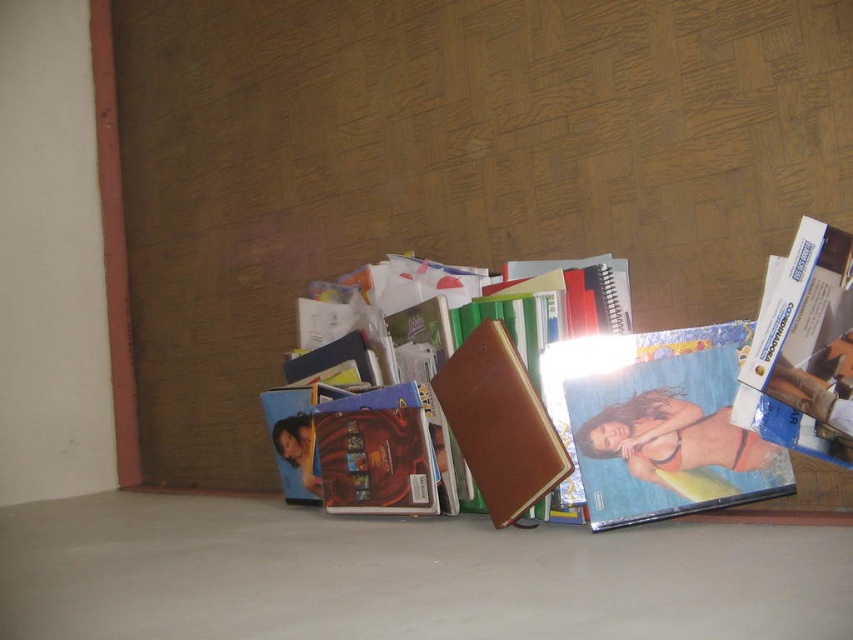
Question: Among these objects, which one is nearest to the camera?

Choices:
 (A) blue glossy book at center
 (B) matte plastic photo at center
 (C) brown leather wallet at center

Answer: (A)

Question: Is blue glossy book at center wider than leather notebook at center?

Choices:
 (A) yes
 (B) no

Answer: (B)

Question: Observing the image, what is the correct spatial positioning of matte plastic photo at center in reference to leather notebook at center?

Choices:
 (A) below
 (B) above

Answer: (B)

Question: Among these points, which one is nearest to the camera?

Choices:
 (A) (846, 340)
 (B) (699, 330)
 (C) (521, 371)
 (D) (572, 296)

Answer: (A)

Question: Does brown leather wallet at center have a larger size compared to leather notebook at center?

Choices:
 (A) no
 (B) yes

Answer: (B)

Question: Which point is closer to the camera taking this photo?

Choices:
 (A) click(601, 330)
 (B) click(361, 512)

Answer: (A)